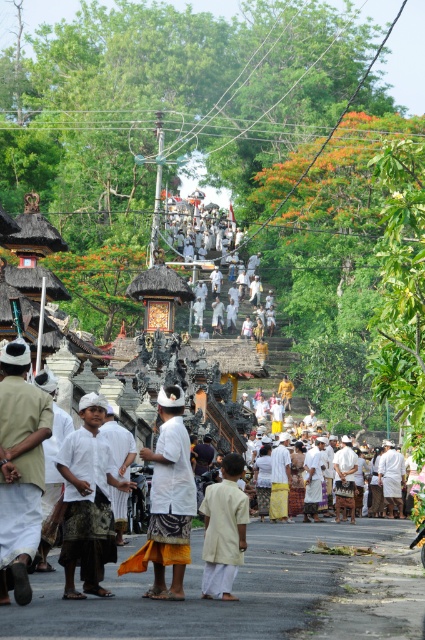
Question: Which of the following is the farthest from the observer?

Choices:
 (A) (36, 404)
 (B) (95, 589)

Answer: (B)

Question: Which of the following is the farthest from the observer?

Choices:
 (A) (204, 596)
 (B) (96, 444)
 (C) (30, 435)

Answer: (B)

Question: Does light beige cotton shirt at left have a larger size compared to light beige fabric at center?

Choices:
 (A) yes
 (B) no

Answer: (A)

Question: Is light beige cotton shirt at left to the left of white woven cloth at center from the viewer's perspective?

Choices:
 (A) no
 (B) yes

Answer: (B)

Question: Is the position of light beige cotton shirt at left less distant than that of white woven cloth at center?

Choices:
 (A) yes
 (B) no

Answer: (A)

Question: Among these points, which one is farthest from the camera?

Choices:
 (A) (207, 593)
 (B) (99, 516)

Answer: (B)